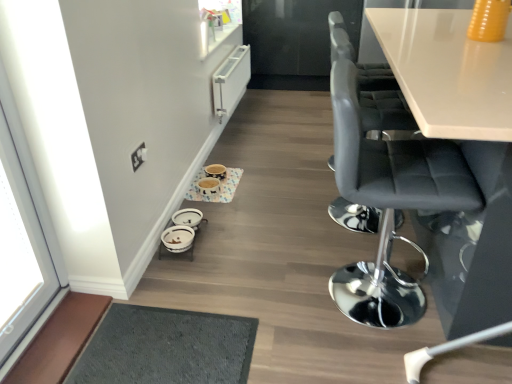
Where is `vacant space that is in between white glass window at left and black leather stool at right, the second chair positioned from the back`? This screenshot has height=384, width=512. vacant space that is in between white glass window at left and black leather stool at right, the second chair positioned from the back is located at coordinates (204, 318).